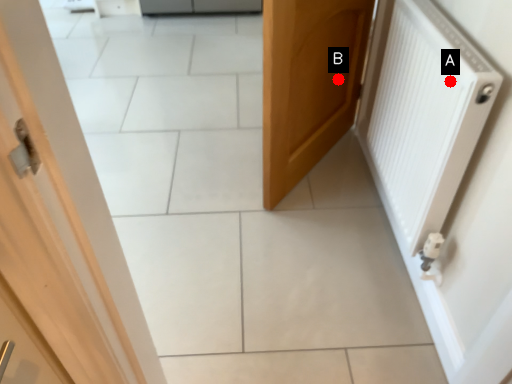
Question: Two points are circled on the image, labeled by A and B beside each circle. Among these points, which one is farthest from the camera?

Choices:
 (A) A is further
 (B) B is further

Answer: (B)